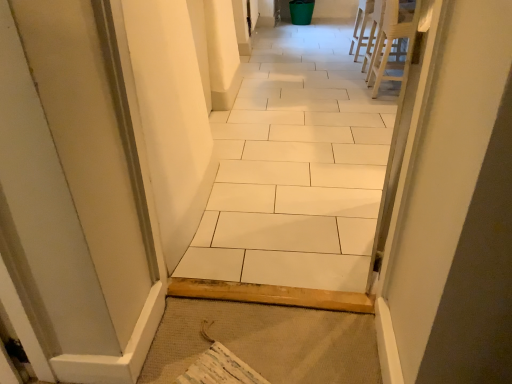
What is the approximate height of white ceramic tile at center?

white ceramic tile at center is 1.09 meters tall.

The image size is (512, 384). What do you see at coordinates (365, 25) in the screenshot? I see `white plastic chair at upper right, which ranks as the second chair in front-to-back order` at bounding box center [365, 25].

The height and width of the screenshot is (384, 512). In order to click on white plastic chair at upper right, which appears as the first chair when viewed from the back in this screenshot , I will do (365, 25).

At what (x,y) coordinates should I click in order to perform the action: click on white plastic chair at upper right, the 1th chair when ordered from front to back. Please return your answer as a coordinate pair (x, y). The height and width of the screenshot is (384, 512). Looking at the image, I should click on (394, 43).

In the scene shown: Is white plastic chair at upper right, which ranks as the second chair in front-to-back order, facing towards white plastic chair at upper right, the 1th chair when ordered from front to back?

No, white plastic chair at upper right, which ranks as the second chair in front-to-back order, is not oriented towards white plastic chair at upper right, the 1th chair when ordered from front to back.

Looking at this image, considering the sizes of objects white plastic chair at upper right, which appears as the first chair when viewed from the back, and white plastic chair at upper right, placed as the 2th chair when sorted from back to front, in the image provided, who is taller, white plastic chair at upper right, which appears as the first chair when viewed from the back, or white plastic chair at upper right, placed as the 2th chair when sorted from back to front,?

With more height is white plastic chair at upper right, placed as the 2th chair when sorted from back to front.

Which is correct: white plastic chair at upper right, which appears as the first chair when viewed from the back, is inside white plastic chair at upper right, placed as the 2th chair when sorted from back to front, or outside of it?

white plastic chair at upper right, which appears as the first chair when viewed from the back, cannot be found inside white plastic chair at upper right, placed as the 2th chair when sorted from back to front.

Who is smaller, white plastic chair at upper right, which appears as the first chair when viewed from the back, or white plastic chair at upper right, placed as the 2th chair when sorted from back to front?

white plastic chair at upper right, which appears as the first chair when viewed from the back.

Is point (380, 50) in front of point (362, 41)?

Yes, point (380, 50) is closer to viewer.

Considering the relative sizes of white plastic chair at upper right, placed as the 2th chair when sorted from back to front, and white plastic chair at upper right, which ranks as the second chair in front-to-back order, in the image provided, is white plastic chair at upper right, placed as the 2th chair when sorted from back to front, wider than white plastic chair at upper right, which ranks as the second chair in front-to-back order,?

Yes, white plastic chair at upper right, placed as the 2th chair when sorted from back to front, is wider than white plastic chair at upper right, which ranks as the second chair in front-to-back order.

Between white plastic chair at upper right, placed as the 2th chair when sorted from back to front, and white plastic chair at upper right, which ranks as the second chair in front-to-back order, which one has larger size?

Bigger between the two is white plastic chair at upper right, placed as the 2th chair when sorted from back to front.

Does white plastic chair at upper right, placed as the 2th chair when sorted from back to front, appear on the right side of white plastic chair at upper right, which appears as the first chair when viewed from the back?

In fact, white plastic chair at upper right, placed as the 2th chair when sorted from back to front, is to the left of white plastic chair at upper right, which appears as the first chair when viewed from the back.

This screenshot has height=384, width=512. In order to click on ceramic tile on the left of the white plastic chair at upper right, which appears as the first chair when viewed from the back in this screenshot , I will do `click(296, 168)`.

From the image's perspective, would you say white plastic chair at upper right, which appears as the first chair when viewed from the back, is shown under white ceramic tile at center?

No.

Can you see white plastic chair at upper right, which appears as the first chair when viewed from the back, touching white ceramic tile at center?

white plastic chair at upper right, which appears as the first chair when viewed from the back, and white ceramic tile at center are not in contact.

Considering the relative sizes of white plastic chair at upper right, which ranks as the second chair in front-to-back order, and white ceramic tile at center in the image provided, is white plastic chair at upper right, which ranks as the second chair in front-to-back order, smaller than white ceramic tile at center?

Yes.

Looking at this image, is white plastic chair at upper right, placed as the 2th chair when sorted from back to front, inside or outside of white ceramic tile at center?

white plastic chair at upper right, placed as the 2th chair when sorted from back to front, is not inside white ceramic tile at center, it's outside.

Considering the positions of points (386, 37) and (239, 235), is point (386, 37) closer to camera compared to point (239, 235)?

That is False.

Is white plastic chair at upper right, placed as the 2th chair when sorted from back to front, next to white ceramic tile at center and touching it?

No, white plastic chair at upper right, placed as the 2th chair when sorted from back to front, is not in contact with white ceramic tile at center.

Does white ceramic tile at center have a greater width compared to white plastic chair at upper right, placed as the 2th chair when sorted from back to front?

No.

Is white ceramic tile at center looking in the opposite direction of white plastic chair at upper right, placed as the 2th chair when sorted from back to front?

white ceramic tile at center does not have its back to white plastic chair at upper right, placed as the 2th chair when sorted from back to front.

From a real-world perspective, which object stands above the other?

In real-world perspective, white ceramic tile at center is above.

Can white plastic chair at upper right, placed as the 2th chair when sorted from back to front, be found inside white ceramic tile at center?

No, white plastic chair at upper right, placed as the 2th chair when sorted from back to front, is not surrounded by white ceramic tile at center.

Which object is further away from the camera, white ceramic tile at center or white plastic chair at upper right, which ranks as the second chair in front-to-back order?

Positioned behind is white plastic chair at upper right, which ranks as the second chair in front-to-back order.

What's the angular difference between white ceramic tile at center and white plastic chair at upper right, which appears as the first chair when viewed from the back,'s facing directions?

white ceramic tile at center and white plastic chair at upper right, which appears as the first chair when viewed from the back, are facing 86.3 degrees away from each other.

Is white ceramic tile at center in contact with white plastic chair at upper right, which ranks as the second chair in front-to-back order?

No, white ceramic tile at center is not touching white plastic chair at upper right, which ranks as the second chair in front-to-back order.

The image size is (512, 384). I want to click on chair that appears above the white plastic chair at upper right, placed as the 2th chair when sorted from back to front (from the image's perspective), so click(365, 25).

The height and width of the screenshot is (384, 512). What are the coordinates of `chair located underneath the white plastic chair at upper right, the 1th chair when ordered from front to back (from a real-world perspective)` in the screenshot? It's located at (365, 25).

From the image, which object appears to be farther from white plastic chair at upper right, placed as the 2th chair when sorted from back to front, white plastic chair at upper right, which appears as the first chair when viewed from the back, or white ceramic tile at center?

Based on the image, white ceramic tile at center appears to be further to white plastic chair at upper right, placed as the 2th chair when sorted from back to front.

When comparing their distances from white ceramic tile at center, does white plastic chair at upper right, which ranks as the second chair in front-to-back order, or white plastic chair at upper right, the 1th chair when ordered from front to back, seem further?

Among the two, white plastic chair at upper right, which ranks as the second chair in front-to-back order, is located further to white ceramic tile at center.

From the image, which object appears to be farther from white plastic chair at upper right, which appears as the first chair when viewed from the back, white plastic chair at upper right, placed as the 2th chair when sorted from back to front, or white ceramic tile at center?

The object further to white plastic chair at upper right, which appears as the first chair when viewed from the back, is white ceramic tile at center.

Considering their positions, is white ceramic tile at center positioned closer to white plastic chair at upper right, which appears as the first chair when viewed from the back, than white plastic chair at upper right, the 1th chair when ordered from front to back?

white plastic chair at upper right, the 1th chair when ordered from front to back.

Considering their positions, is white ceramic tile at center positioned further to white plastic chair at upper right, the 1th chair when ordered from front to back, than white plastic chair at upper right, which appears as the first chair when viewed from the back?

Based on the image, white ceramic tile at center appears to be further to white plastic chair at upper right, the 1th chair when ordered from front to back.

Which object lies nearer to the anchor point white ceramic tile at center, white plastic chair at upper right, the 1th chair when ordered from front to back, or white plastic chair at upper right, which appears as the first chair when viewed from the back?

white plastic chair at upper right, the 1th chair when ordered from front to back, is positioned closer to the anchor white ceramic tile at center.

Locate an element on the screen. chair located between white ceramic tile at center and white plastic chair at upper right, which appears as the first chair when viewed from the back, in the depth direction is located at coordinates (394, 43).